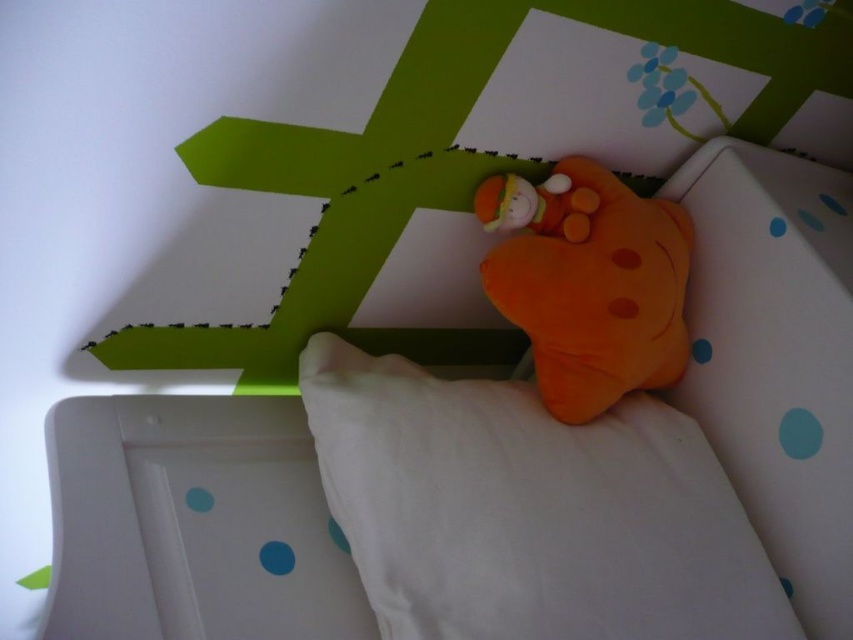
You are a parent trying to place two orange plush toys in your child bedroom. The orange plush toy at upper center and the fluffy orange plush at upper center are both on the pillow. Which one is wider?

The orange plush toy at upper center is wider than the fluffy orange plush at upper center.

You are a parent looking for your child toys. You see an orange plush toy at upper center and a fluffy orange plush at upper center. Which one is located to the right?

The orange plush toy at upper center is located to the right of the fluffy orange plush at upper center.

You are a parent trying to place a stuffed animal on the white soft pillow at upper center. According to the coordinates provided, where exactly should you place the stuffed animal?

The white soft pillow at upper center is located at coordinates point [531,509], so you should place the stuffed animal there.